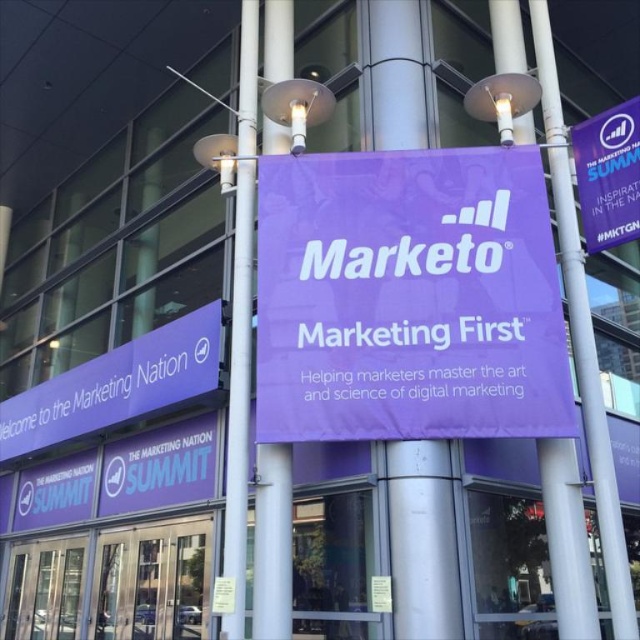
Question: Which point appears closest to the camera in this image?

Choices:
 (A) (228, 426)
 (B) (216, 301)
 (C) (134, 442)
 (D) (611, 204)

Answer: (D)

Question: Where is matte purple banner at lower left located in relation to blue fabric banner at lower left in the image?

Choices:
 (A) below
 (B) above

Answer: (B)

Question: Which point is closer to the camera?

Choices:
 (A) (10, 406)
 (B) (586, 129)
 (C) (269, 353)

Answer: (C)

Question: Is metallic silver pole at center wider than purple fabric banner at upper right?

Choices:
 (A) no
 (B) yes

Answer: (A)

Question: Does purple fabric banner at center appear on the left side of purple fabric banner at upper right?

Choices:
 (A) yes
 (B) no

Answer: (A)

Question: Which point is closer to the camera taking this photo?

Choices:
 (A) (577, 129)
 (B) (168, 467)

Answer: (A)